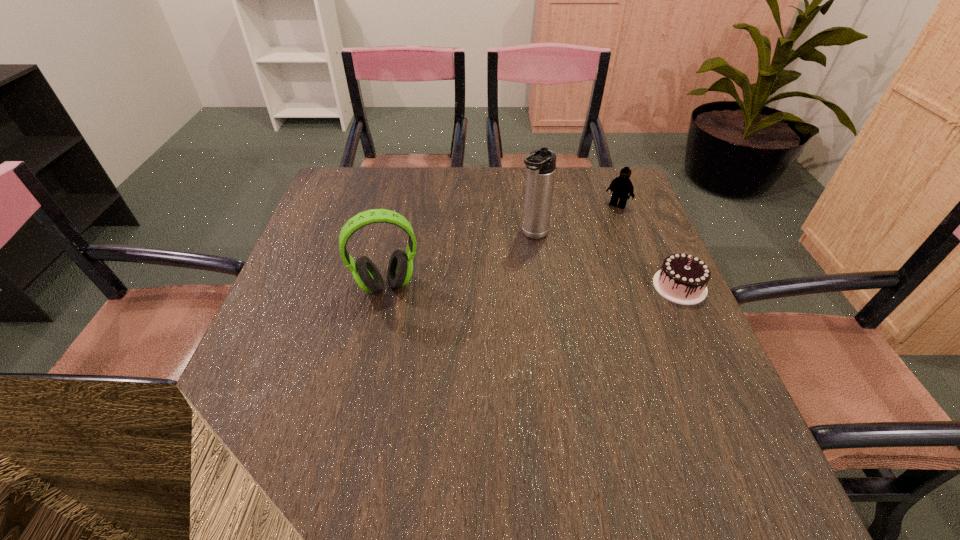
What are the coordinates of `vacant space on the desktop that is between the leftmost object and the chocolate cake and is positioned on the face of the farthest object` in the screenshot? It's located at (x=559, y=286).

Find the location of a particular element. The width and height of the screenshot is (960, 540). vacant space on the desktop that is between the leftmost object and the shortest object and is positioned on the handle side of the tallest object is located at coordinates pyautogui.click(x=490, y=286).